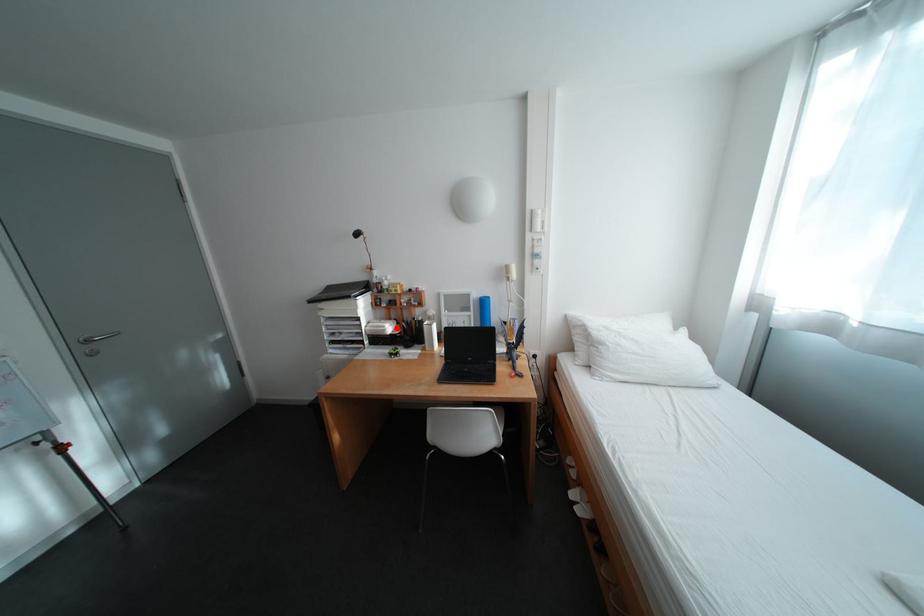
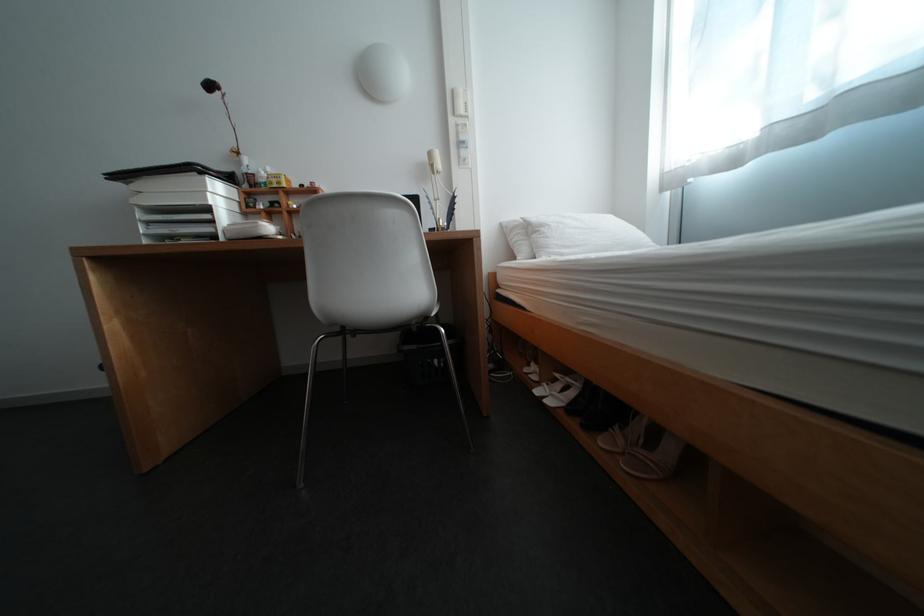
In the second image, find the point that corresponds to the highlighted location in the first image.

(270, 224)